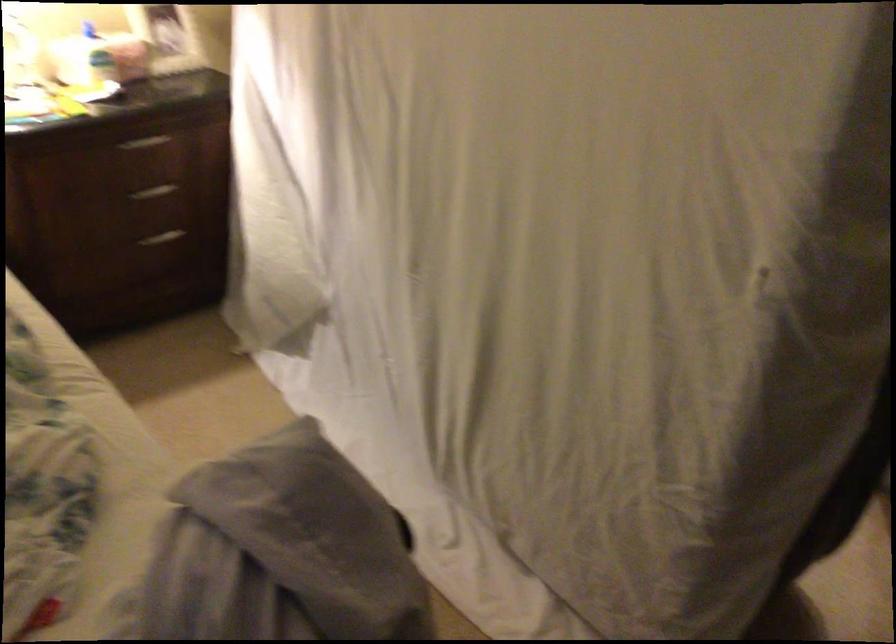
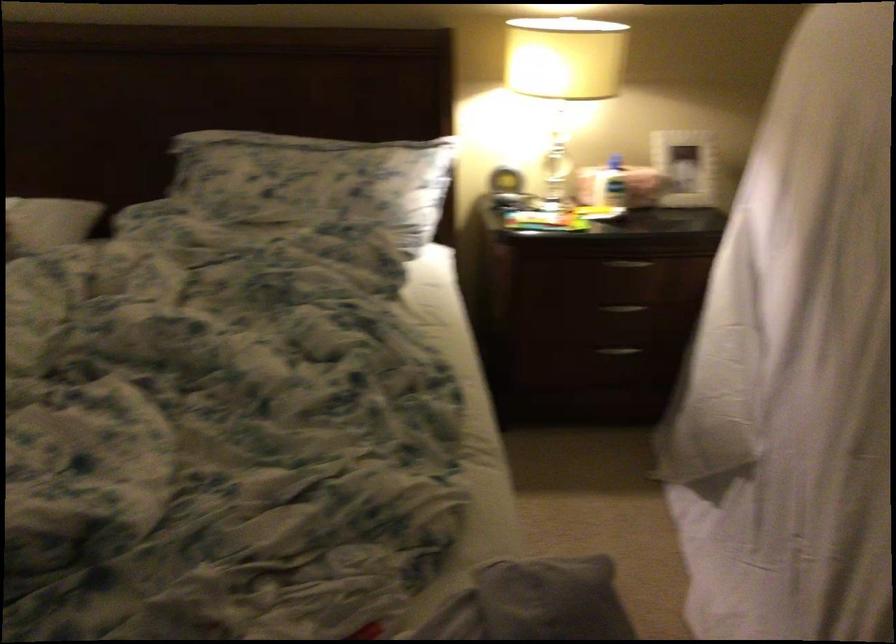
Find the pixel in the second image that matches (161,250) in the first image.

(616, 355)